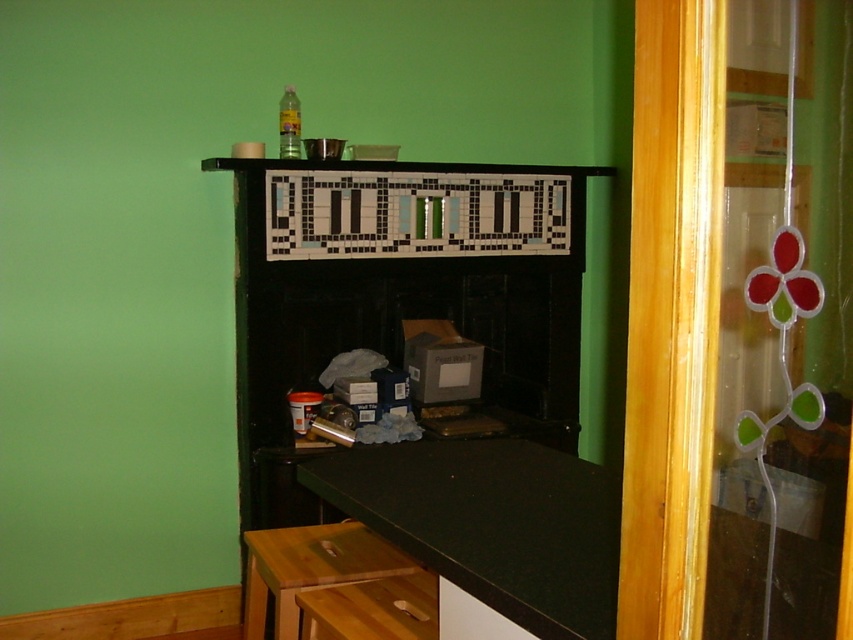
You are standing in the room and want to reach a point that is 34.29 inches away from you. Is the point at coordinates point (779, 1) within that distance?

The distance of point (779, 1) from camera is 34.29 inches, so yes, the point at coordinates point (779, 1) is exactly 34.29 inches away from you.

You are standing in the room and want to place a small plant on the counter. The stained glass at right is above the black laminate counter top at lower center. Where should you place the plant to ensure it gets sunlight through the stained glass?

Place the plant on the black laminate counter top at lower center directly beneath the stained glass at right to ensure it receives sunlight filtering through the stained glass.

You are organizing the items on the black laminate counter top at lower center and the white matte drawer at lower center. Since you have limited space, which surface can hold more items?

The black laminate counter top at lower center is bigger than the white matte drawer at lower center, so it can hold more items.